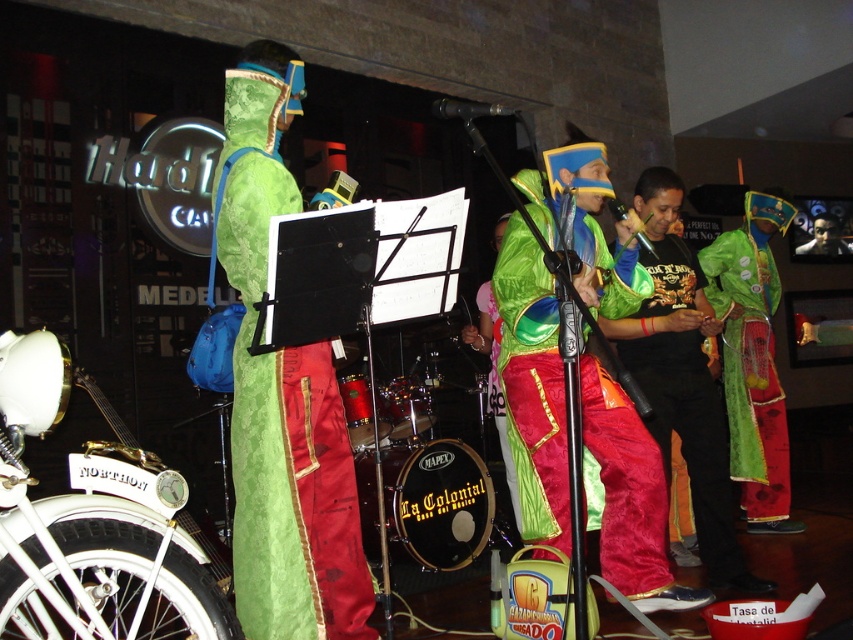
Question: Among these points, which one is farthest from the camera?

Choices:
 (A) (814, 225)
 (B) (271, 612)
 (C) (503, 424)

Answer: (A)

Question: Is green velvet costume at center further to the viewer compared to green velvet robe at center?

Choices:
 (A) no
 (B) yes

Answer: (A)

Question: Among these objects, which one is nearest to the camera?

Choices:
 (A) green velvet robe at center
 (B) velvet green robe at center

Answer: (B)

Question: Is green velvet costume at center bigger than velvet green robe at center?

Choices:
 (A) no
 (B) yes

Answer: (A)

Question: Which object is positioned farthest from the velvet green and red costume at center?

Choices:
 (A) smooth black mask at upper right
 (B) shiny metallic pants at center
 (C) green velvet costume at center
 (D) green velvet robe at center

Answer: (A)

Question: Can you confirm if shiny metallic pants at center is wider than smooth black mask at upper right?

Choices:
 (A) no
 (B) yes

Answer: (A)